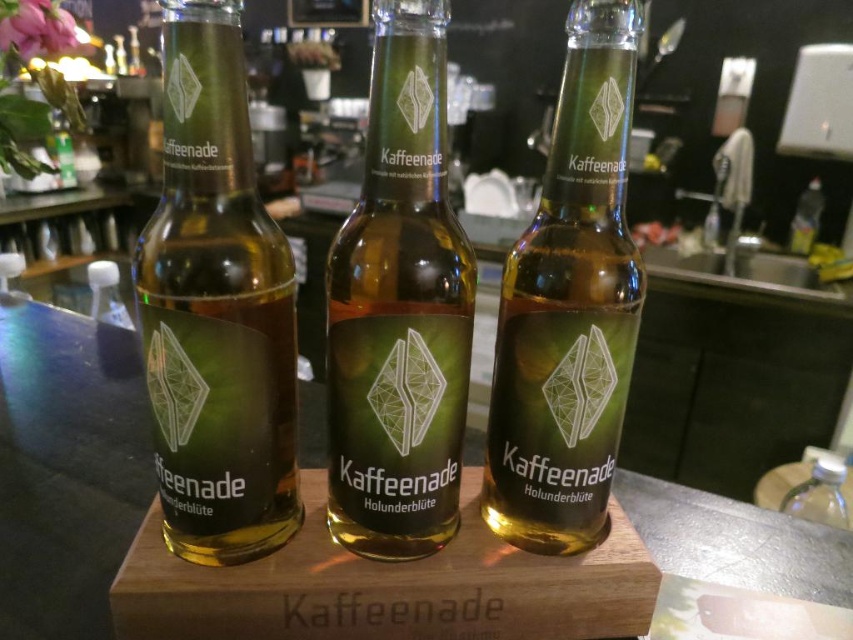
Describe the element at coordinates (569, 307) in the screenshot. I see `green glass bottle at center` at that location.

Between green glass bottle at center and transparent plastic bottle at lower right, which one appears on the left side from the viewer's perspective?

green glass bottle at center

You are a GUI agent. You are given a task and a screenshot of the screen. Output one action in this format:
    pyautogui.click(x=<x>, y=<y>)
    Task: Click on the green glass bottle at center
    
    Given the screenshot: What is the action you would take?
    click(569, 307)

Between green glass bottle at left and green matte glass bottle at center, which one has more height?

Standing taller between the two is green matte glass bottle at center.

Is point (279, 390) positioned before point (393, 250)?

No, it is behind (393, 250).

Locate an element on the screen. green glass bottle at left is located at coordinates (216, 307).

Between green matte glass bottle at center and green glass bottle at center, which one has more height?

With more height is green glass bottle at center.

Is the position of green matte glass bottle at center more distant than that of green glass bottle at center?

No.

Between point (448, 410) and point (611, 273), which one is positioned in front?

Positioned in front is point (611, 273).

This screenshot has height=640, width=853. Find the location of `green matte glass bottle at center`. green matte glass bottle at center is located at coordinates (399, 308).